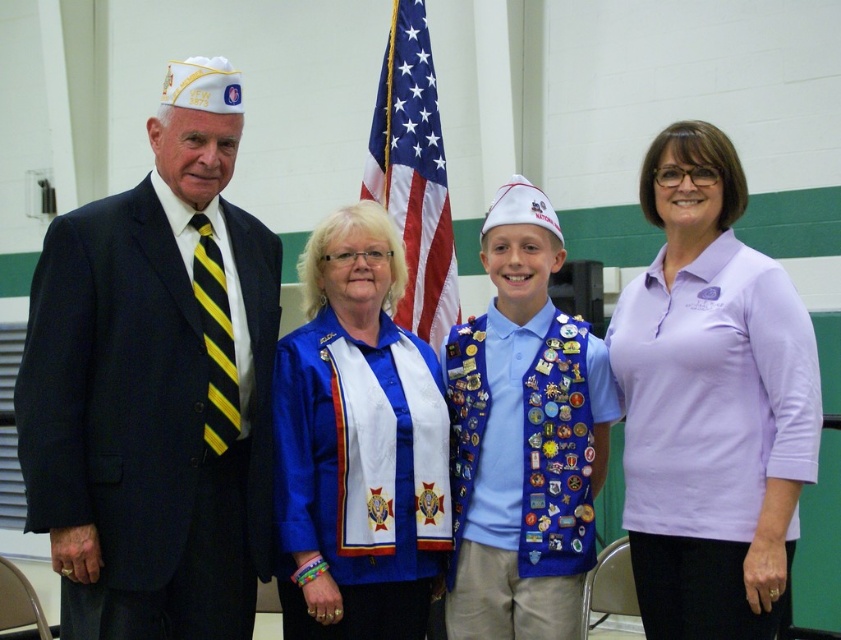
Is matte black suit at left in front of blue velvet sash at center?

Yes, matte black suit at left is closer to the viewer.

Find the location of `matte black suit at left`. matte black suit at left is located at coordinates tap(156, 387).

Who is lower down, matte black suit at left or lavender cotton polo shirt at center?

lavender cotton polo shirt at center

Measure the distance from matte black suit at left to lavender cotton polo shirt at center.

matte black suit at left is 1.96 meters away from lavender cotton polo shirt at center.

Where is `matte black suit at left`? The height and width of the screenshot is (640, 841). matte black suit at left is located at coordinates (156, 387).

You are a GUI agent. You are given a task and a screenshot of the screen. Output one action in this format:
    pyautogui.click(x=<x>, y=<y>)
    Task: Click on the matte black suit at left
    The image size is (841, 640).
    Given the screenshot: What is the action you would take?
    pyautogui.click(x=156, y=387)

Between blue velvet sash at center and american flag at center, which one is positioned higher?

american flag at center is above.

Can you confirm if blue velvet sash at center is positioned above american flag at center?

Incorrect, blue velvet sash at center is not positioned above american flag at center.

This screenshot has height=640, width=841. I want to click on blue velvet sash at center, so click(x=522, y=436).